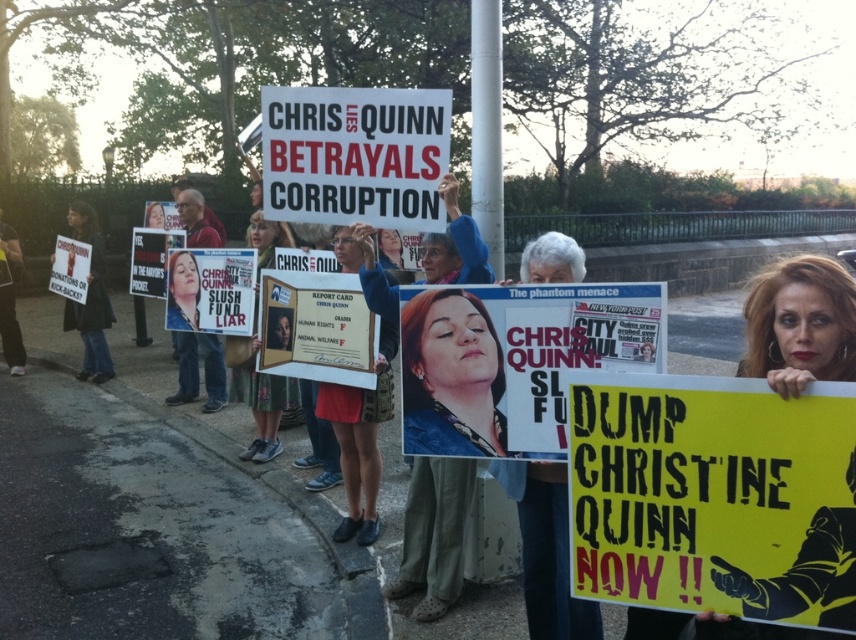
Is white paper sign at center smaller than matte yellow sign at center?

Correct, white paper sign at center occupies less space than matte yellow sign at center.

The width and height of the screenshot is (856, 640). Find the location of `white paper sign at center`. white paper sign at center is located at coordinates (355, 154).

Identify the location of white paper sign at center. (355, 154).

Who is higher up, matte paper report card at center or black fabric jacket at left?

Positioned higher is black fabric jacket at left.

Between matte paper report card at center and black fabric jacket at left, which one appears on the left side from the viewer's perspective?

From the viewer's perspective, black fabric jacket at left appears more on the left side.

This screenshot has width=856, height=640. What are the coordinates of `matte paper report card at center` in the screenshot? It's located at (354, 458).

Does matte yellow sign at center have a larger size compared to wooden plaque at center?

Yes.

Who is positioned more to the left, matte yellow sign at center or wooden plaque at center?

wooden plaque at center

What do you see at coordinates (800, 324) in the screenshot? I see `matte yellow sign at center` at bounding box center [800, 324].

The image size is (856, 640). What are the coordinates of `matte yellow sign at center` in the screenshot? It's located at (800, 324).